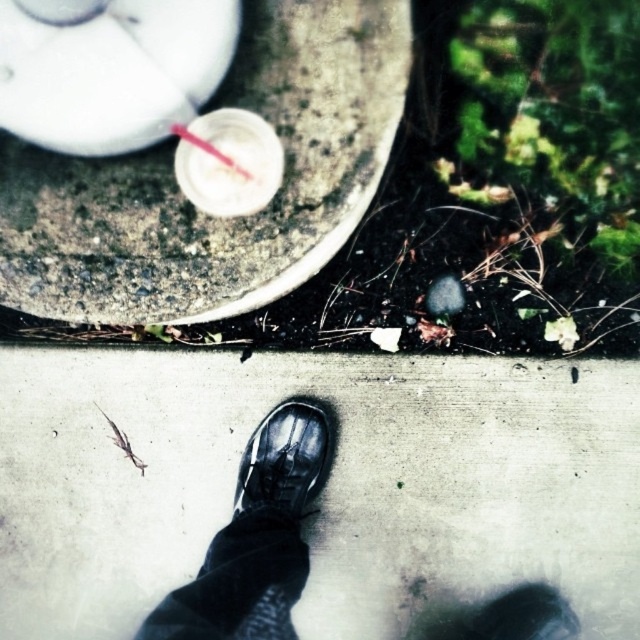
Question: Which object is closer to the camera taking this photo?

Choices:
 (A) matte concrete sidewalk at center
 (B) shiny black shoe at center
 (C) clear plastic straw at center
 (D) gray concrete at upper center

Answer: (D)

Question: Considering the real-world distances, which object is closest to the matte concrete sidewalk at center?

Choices:
 (A) clear plastic straw at center
 (B) shiny black shoe at center
 (C) gray concrete at upper center

Answer: (B)

Question: Is matte concrete sidewalk at center positioned behind clear plastic straw at center?

Choices:
 (A) no
 (B) yes

Answer: (B)

Question: Is gray concrete at upper center above clear plastic straw at center?

Choices:
 (A) no
 (B) yes

Answer: (A)

Question: Does gray concrete at upper center appear on the right side of clear plastic straw at center?

Choices:
 (A) yes
 (B) no

Answer: (B)

Question: Which of the following is the farthest from the observer?

Choices:
 (A) clear plastic straw at center
 (B) shiny black shoe at center
 (C) matte concrete sidewalk at center

Answer: (C)